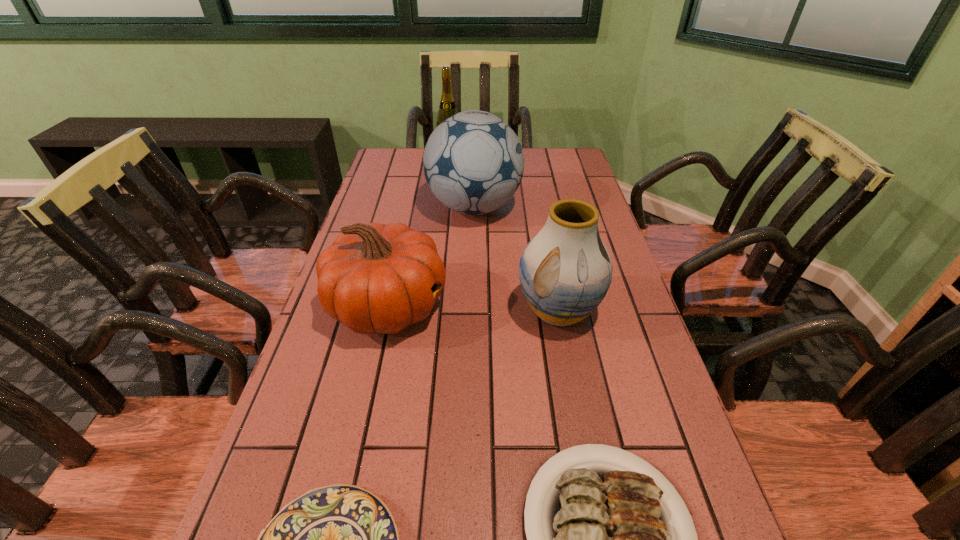
Find the location of a particular element. This screenshot has height=540, width=960. free space that satisfies the following two spatial constraints: 1. on the front-facing side of the wine bottle; 2. on the face of the pumpkin is located at coordinates (433, 306).